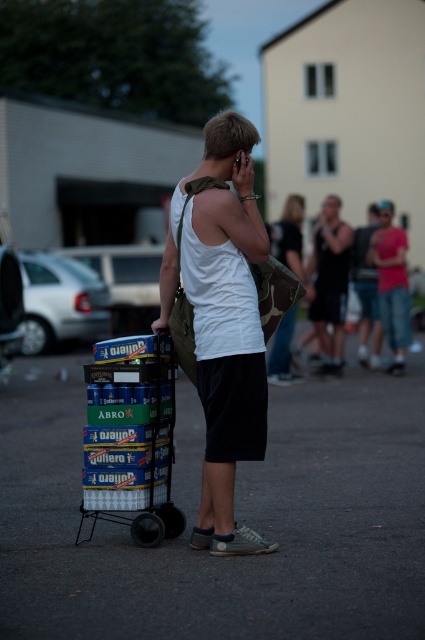
Which of these two, white matte tank top at center or blue cardboard trolley at center, stands taller?

white matte tank top at center is taller.

Can you confirm if white matte tank top at center is positioned to the right of blue cardboard trolley at center?

Correct, you'll find white matte tank top at center to the right of blue cardboard trolley at center.

Which is behind, point (201, 522) or point (116, 380)?

The point (116, 380) is behind.

This screenshot has width=425, height=640. I want to click on white matte tank top at center, so click(223, 323).

Is white matte tank top at center below black tank top at center?

Yes.

Does white matte tank top at center appear on the left side of black tank top at center?

Yes, white matte tank top at center is to the left of black tank top at center.

Locate an element on the screen. The height and width of the screenshot is (640, 425). white matte tank top at center is located at coordinates (223, 323).

This screenshot has height=640, width=425. I want to click on white matte tank top at center, so click(x=223, y=323).

Does blue cardboard trolley at center have a greater height compared to black tank top at center?

No, blue cardboard trolley at center is not taller than black tank top at center.

Does blue cardboard trolley at center have a lesser height compared to black tank top at center?

Correct, blue cardboard trolley at center is not as tall as black tank top at center.

Find the location of a particular element. This screenshot has height=640, width=425. blue cardboard trolley at center is located at coordinates (132, 442).